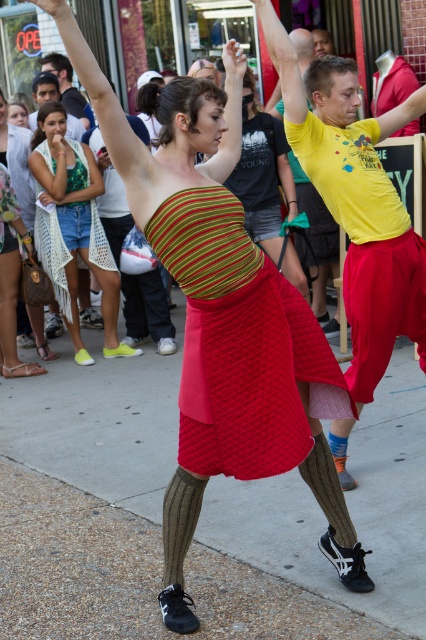
Question: Is matte yellow t-shirt at center further to camera compared to matte green dress at center?

Choices:
 (A) yes
 (B) no

Answer: (B)

Question: Where is matte yellow t-shirt at center located in relation to knitted green and yellow top at center in the image?

Choices:
 (A) above
 (B) below

Answer: (B)

Question: Based on their relative distances, which object is farther from the knitted red skirt at center?

Choices:
 (A) smooth concrete pavement at center
 (B) matte black shirt at upper left
 (C) quilted red dress at center

Answer: (C)

Question: Considering the real-world distances, which object is closest to the matte green dress at center?

Choices:
 (A) quilted red dress at center
 (B) knitted red skirt at center

Answer: (B)

Question: Can you confirm if matte yellow t-shirt at center is bigger than matte green dress at center?

Choices:
 (A) yes
 (B) no

Answer: (A)

Question: Which point is farther to the camera?

Choices:
 (A) click(x=17, y=147)
 (B) click(x=138, y=605)
 (C) click(x=183, y=429)
 (D) click(x=83, y=237)

Answer: (A)